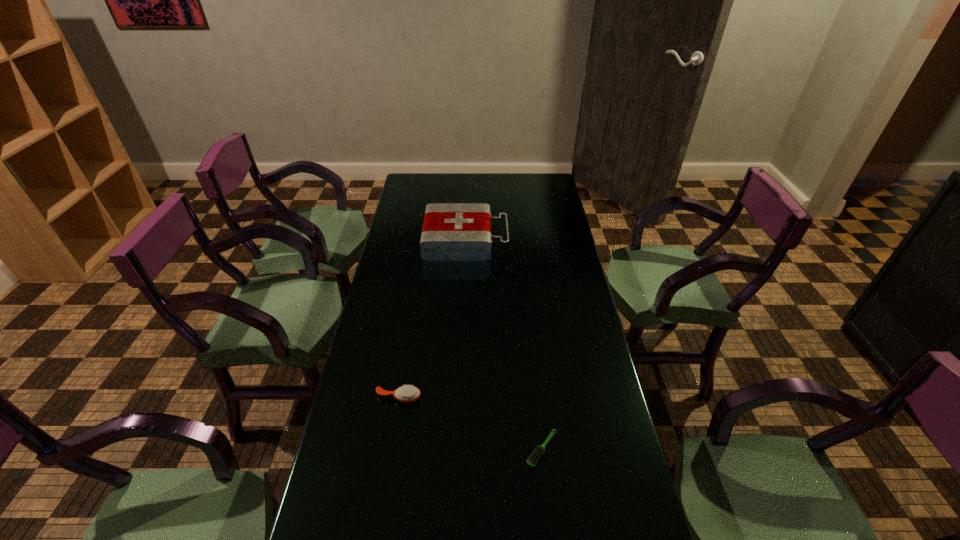
At what (x,y) coordinates should I click in order to perform the action: click on blank area in the image that satisfies the following two spatial constraints: 1. on the front side of the farthest object; 2. on the front side of the second nearest object. Please return your answer as a coordinate pair (x, y). This screenshot has width=960, height=540. Looking at the image, I should click on (459, 398).

Locate an element on the screen. The image size is (960, 540). free spot that satisfies the following two spatial constraints: 1. on the front side of the shorter hairbrush; 2. on the left side of the first-aid kit is located at coordinates (457, 449).